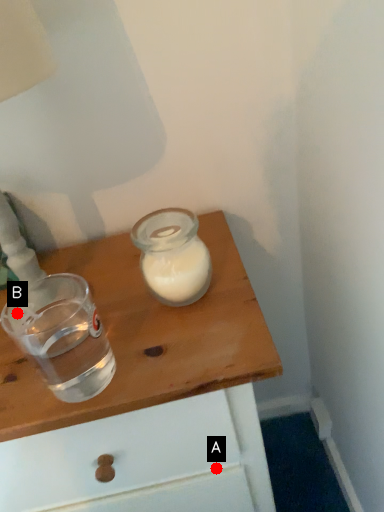
Question: Two points are circled on the image, labeled by A and B beside each circle. Which point appears closest to the camera in this image?

Choices:
 (A) A is closer
 (B) B is closer

Answer: (B)